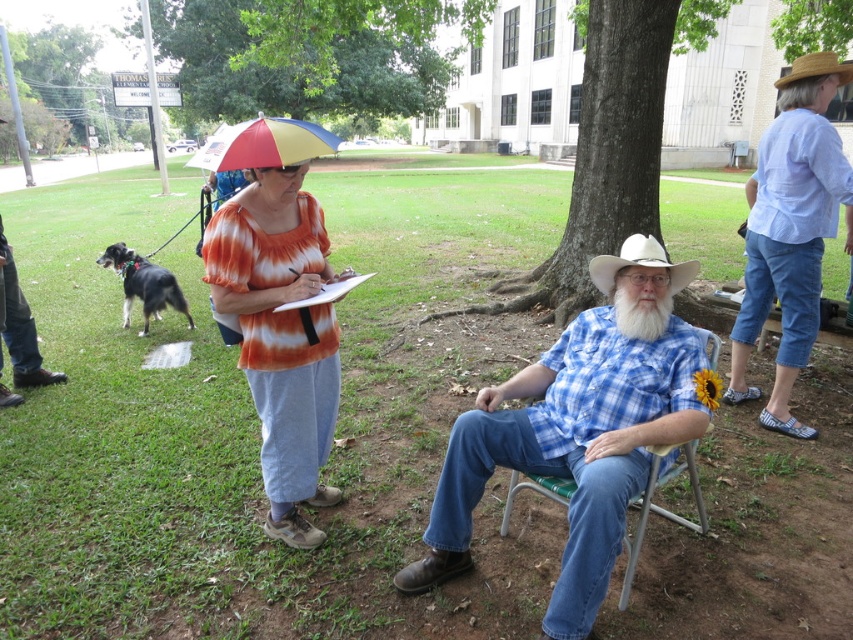
You are a photographer standing at a certain distance from the blue plaid shirt at center. You want to take a photo that requires you to be exactly 8 feet away from the subject. Is your current position suitable for taking this photo?

The distance between you and the blue plaid shirt at center is 7.19 feet, which is less than the required 8 feet. Therefore, you need to move back approximately 0.81 feet to achieve the desired distance.

What is the location of the point with coordinates (x=791, y=230) in the image?

The point with coordinates (x=791, y=230) is located on the blue denim pants at right.